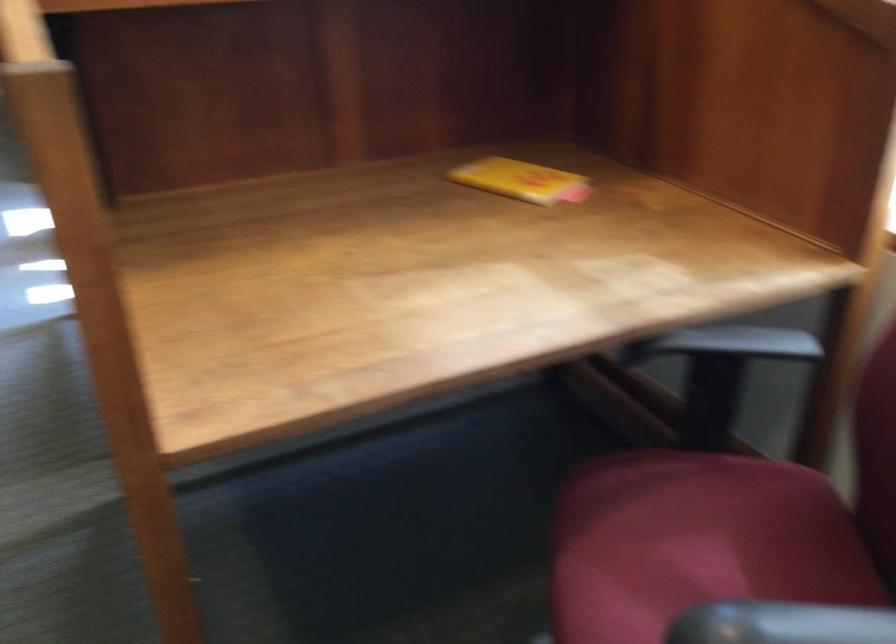
The height and width of the screenshot is (644, 896). In order to click on small yellow box in this screenshot , I will do `click(521, 180)`.